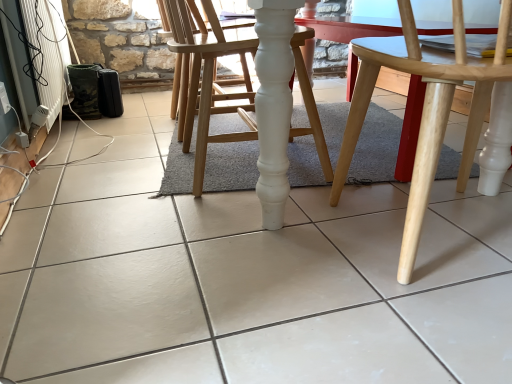
Identify the location of vacant region to the left of white wood chair at center, which ranks as the 1th chair in left-to-right order. The width and height of the screenshot is (512, 384). (110, 170).